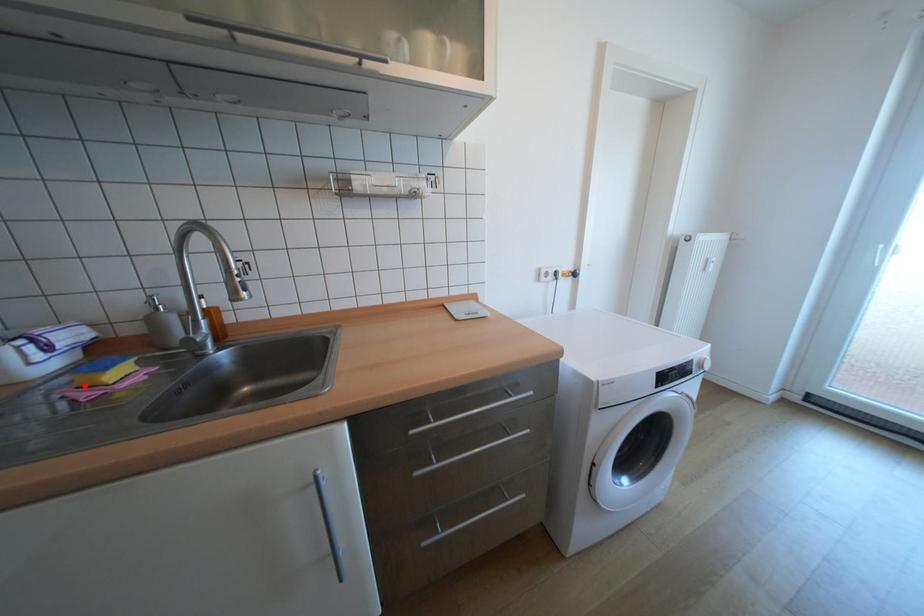
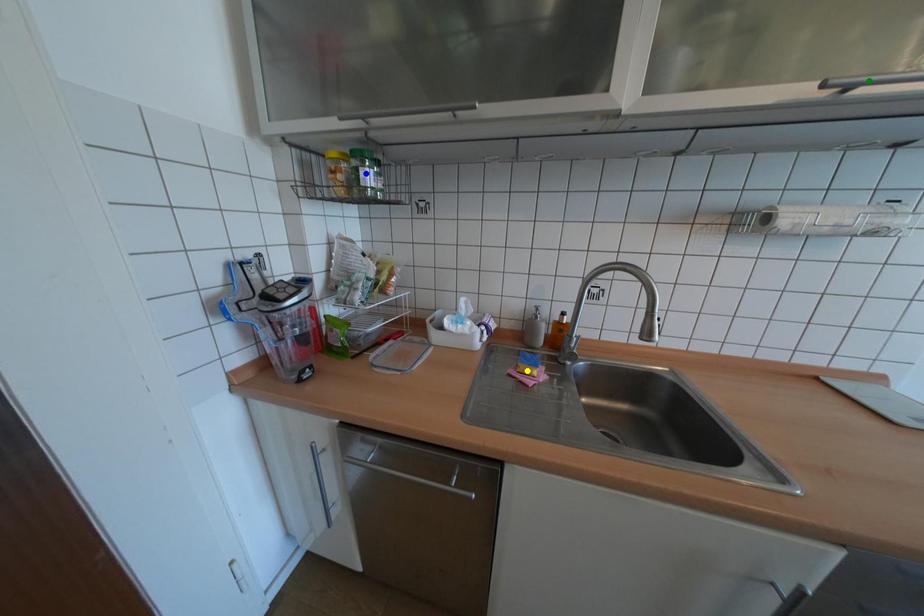
Question: I am providing you with two images of the same scene from different viewpoints. A red point is marked on the first image. You are given multiple points on the second image. Which point in image 2 represents the same 3d spot as the red point in image 1?

Choices:
 (A) blue point
 (B) green point
 (C) yellow point

Answer: (C)